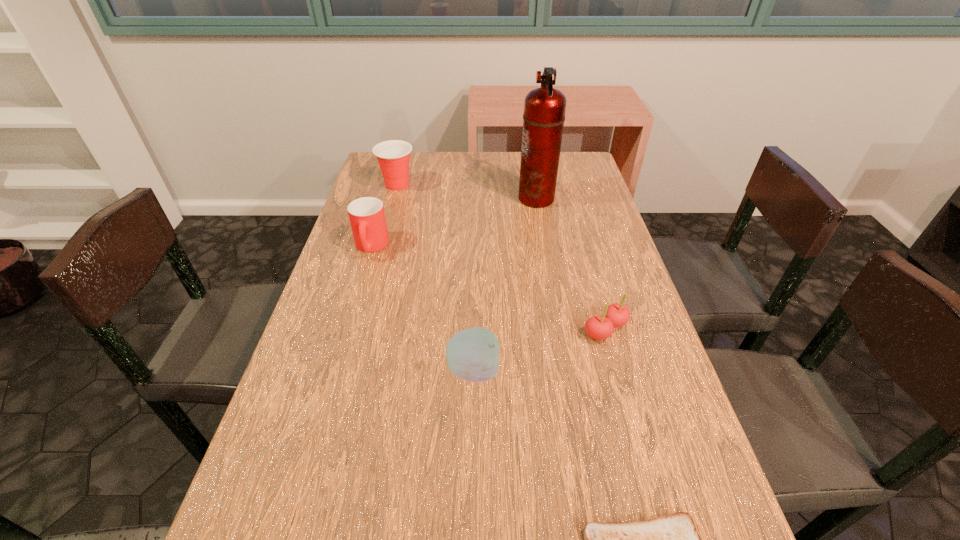
I want to click on vacant space that satisfies the following two spatial constraints: 1. on the side of the fire extinguisher with the handle and hose; 2. on the side of the nearer cup with the handle, so click(x=544, y=247).

Image resolution: width=960 pixels, height=540 pixels. I want to click on free spot that satisfies the following two spatial constraints: 1. on the side of the fourth object from right to left with the handle; 2. on the left side of the fourth nearest object, so click(x=334, y=370).

Where is `free point that satisfies the following two spatial constraints: 1. on the back side of the second shortest object; 2. on the left side of the apple`? The width and height of the screenshot is (960, 540). free point that satisfies the following two spatial constraints: 1. on the back side of the second shortest object; 2. on the left side of the apple is located at coordinates (474, 330).